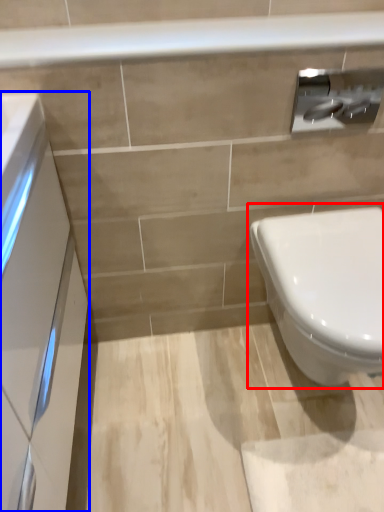
Question: Which object is closer to the camera taking this photo, toilet (highlighted by a red box) or porcelain (highlighted by a blue box)?

Choices:
 (A) toilet
 (B) porcelain

Answer: (B)